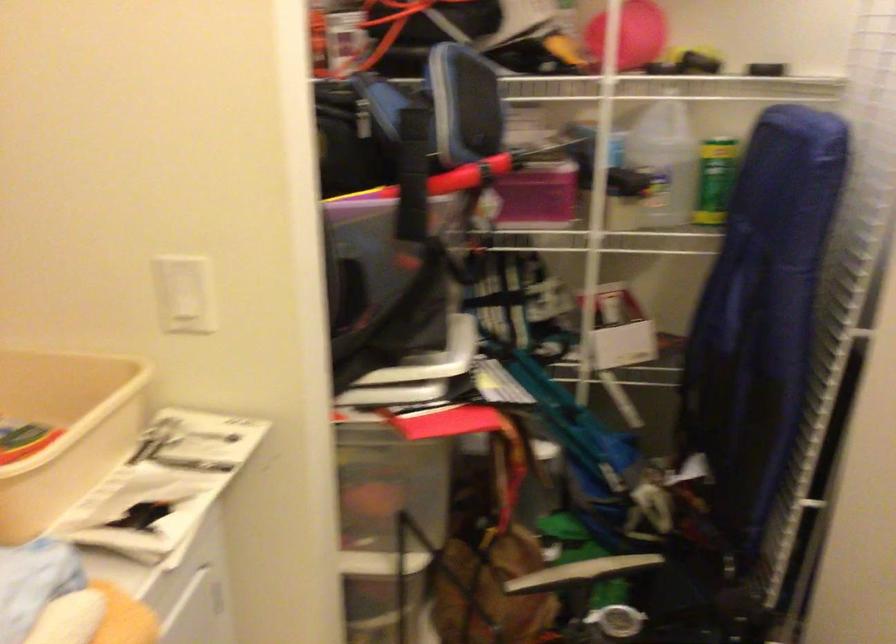
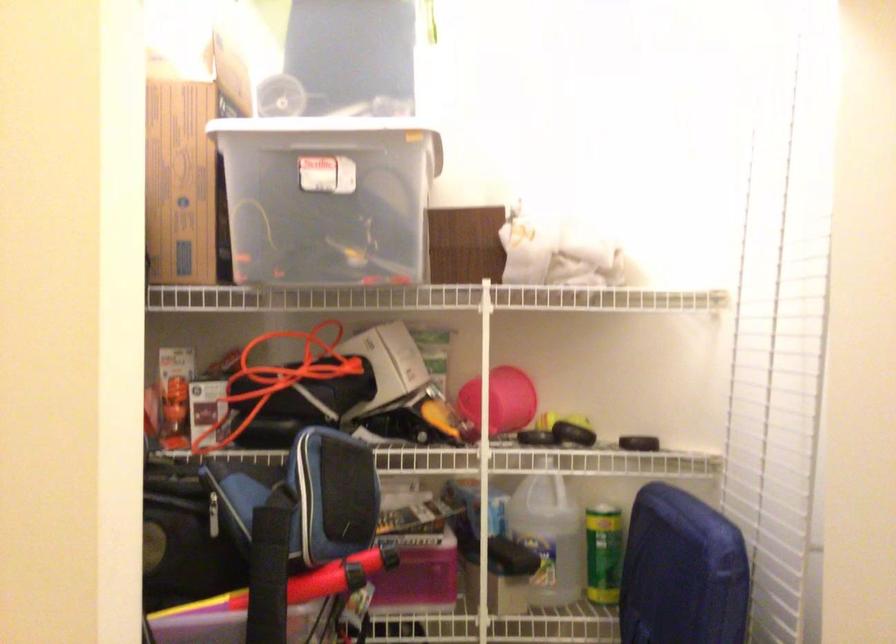
Question: How did the camera likely rotate?

Choices:
 (A) Left
 (B) Right
 (C) Up
 (D) Down

Answer: (C)